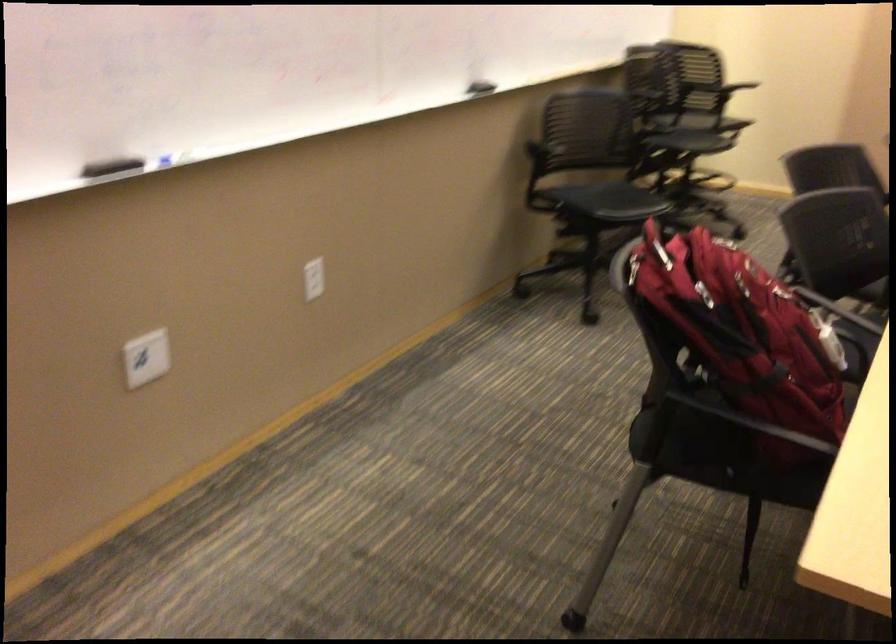
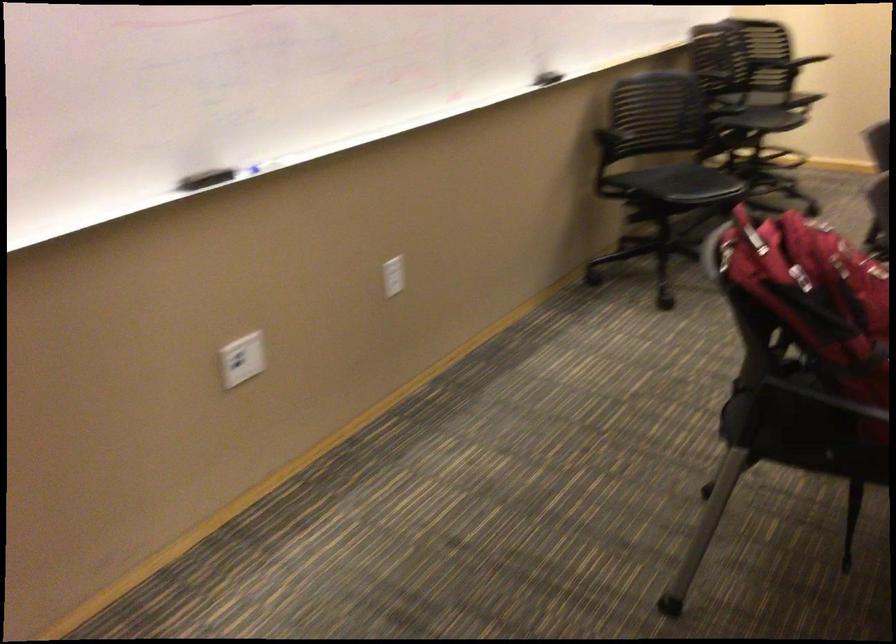
Where in the second image is the point corresponding to [735,313] from the first image?

(815, 295)